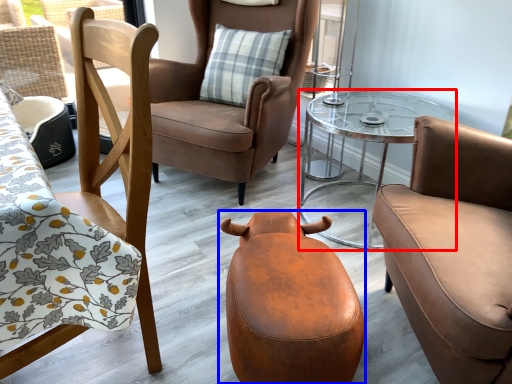
Question: Among these objects, which one is farthest to the camera, table (highlighted by a red box) or swivel chair (highlighted by a blue box)?

Choices:
 (A) table
 (B) swivel chair

Answer: (A)